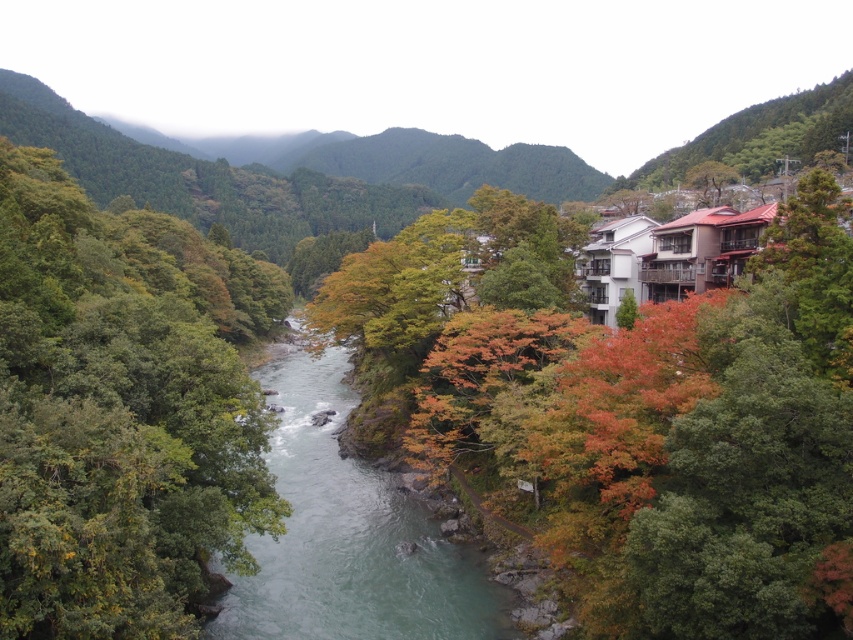
Question: Is green leafy trees at left smaller than clear water at center?

Choices:
 (A) no
 (B) yes

Answer: (A)

Question: Which of the following is the closest to the observer?

Choices:
 (A) (67, 580)
 (B) (755, 440)

Answer: (A)

Question: Which object appears closest to the camera in this image?

Choices:
 (A) green leafy trees at left
 (B) clear water at center

Answer: (A)

Question: Which object is closer to the camera taking this photo?

Choices:
 (A) clear water at center
 (B) green leafy trees at left
 (C) autumn leaves at center

Answer: (B)

Question: Does autumn leaves at center appear on the left side of green leafy trees at left?

Choices:
 (A) no
 (B) yes

Answer: (A)

Question: Can you confirm if autumn leaves at center is bigger than green leafy trees at left?

Choices:
 (A) no
 (B) yes

Answer: (A)